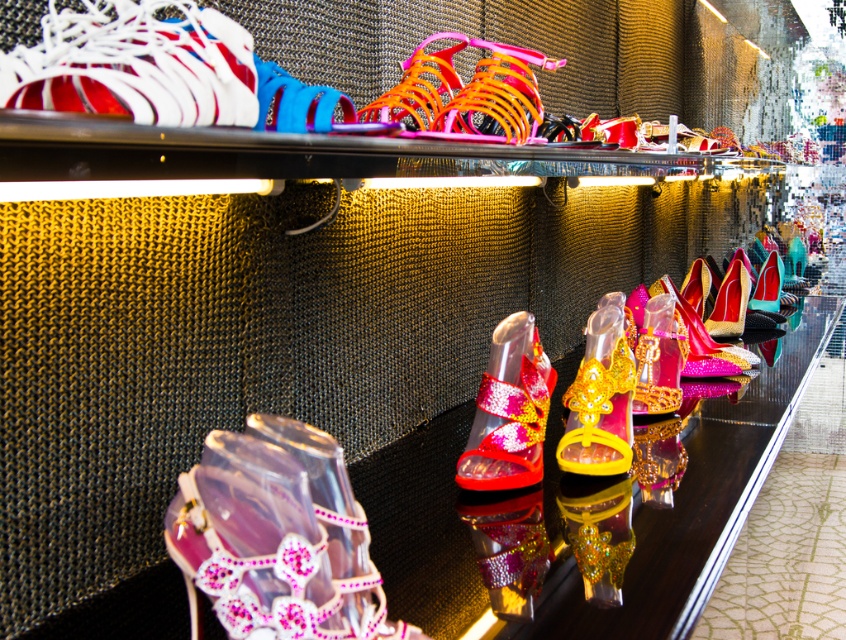
Is point (191, 596) positioned in front of point (121, 84)?

No.

Does clear plastic sandal at lower left have a lesser height compared to white matte sandal at upper left?

Incorrect, clear plastic sandal at lower left's height does not fall short of white matte sandal at upper left's.

Which is behind, point (350, 612) or point (113, 83)?

Positioned behind is point (350, 612).

At what (x,y) coordinates should I click in order to perform the action: click on clear plastic sandal at lower left. Please return your answer as a coordinate pair (x, y). Looking at the image, I should click on (277, 538).

Who is higher up, white matte sandal at upper left or shiny multicolored high-heeled shoe at center?

white matte sandal at upper left is higher up.

Locate an element on the screen. Image resolution: width=846 pixels, height=640 pixels. white matte sandal at upper left is located at coordinates (136, 65).

Identify the location of white matte sandal at upper left. (136, 65).

Is point (268, 579) closer to viewer compared to point (504, 513)?

Yes, it is in front of point (504, 513).

Does clear plastic sandal at lower left appear under shiny multicolored high-heeled shoe at center?

No, clear plastic sandal at lower left is not below shiny multicolored high-heeled shoe at center.

Which is in front, point (176, 522) or point (489, 547)?

Point (176, 522) is in front.

Where is `clear plastic sandal at lower left`? This screenshot has width=846, height=640. clear plastic sandal at lower left is located at coordinates tap(277, 538).